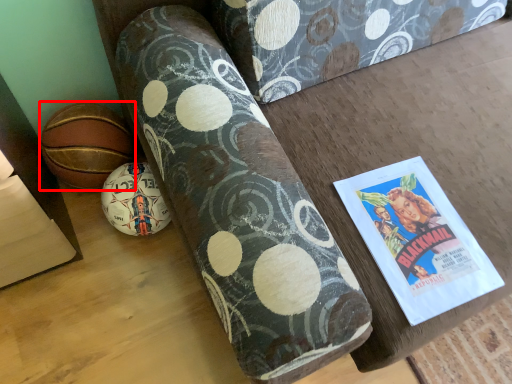
Question: From the image, what is the correct spatial relationship of ball (annotated by the red box) in relation to ball?

Choices:
 (A) right
 (B) left

Answer: (B)